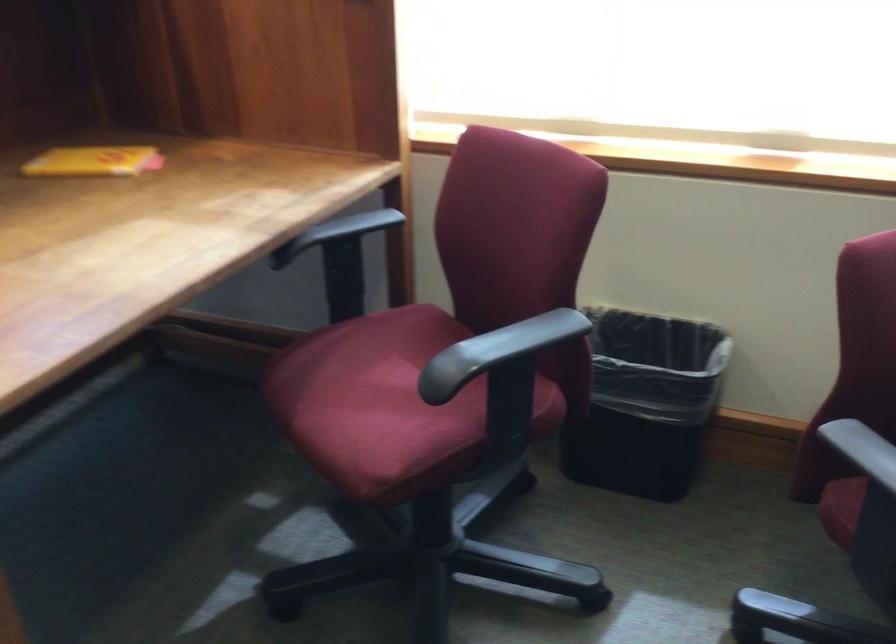
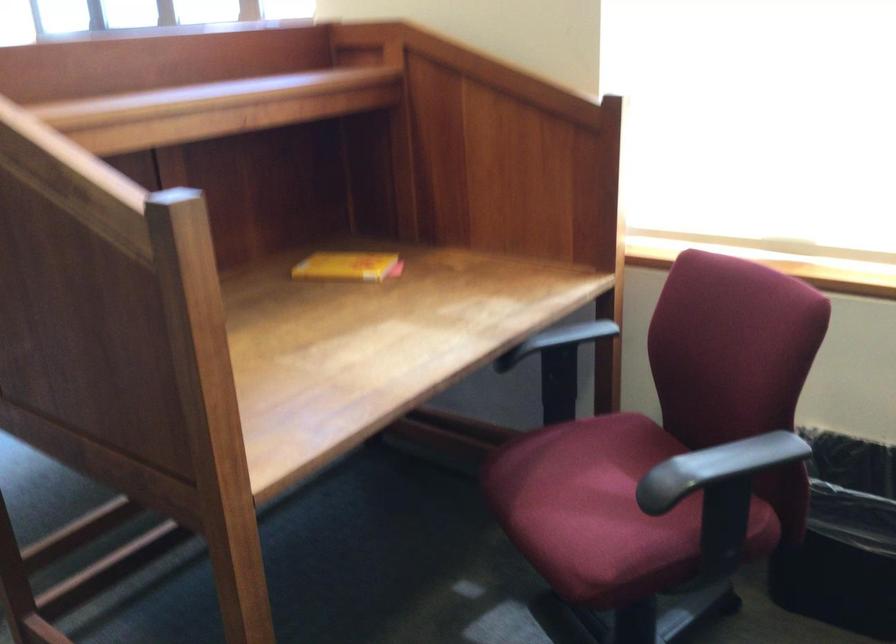
In the second image, find the point that corresponds to [95,158] in the first image.

(348, 266)